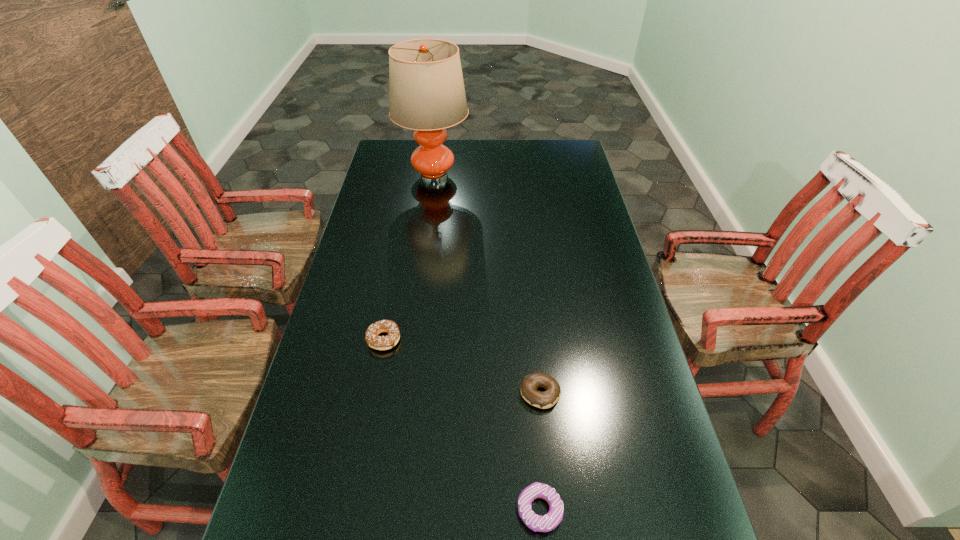
Identify which object is the third closest to the tallest object. Please provide its 2D coordinates. Your answer should be formatted as a tuple, i.e. [(x, y)], where the tuple contains the x and y coordinates of a point satisfying the conditions above.

[(546, 523)]

Where is `doughnut that is the second closest one to the second nearest doughnut`? The width and height of the screenshot is (960, 540). doughnut that is the second closest one to the second nearest doughnut is located at coordinates (373, 340).

Locate which doughnut ranks in proximity to the farthest object. Please provide its 2D coordinates. Your answer should be formatted as a tuple, i.e. [(x, y)], where the tuple contains the x and y coordinates of a point satisfying the conditions above.

[(373, 340)]

Where is `blank space that satisfies the following two spatial constraints: 1. on the front side of the third nearest object; 2. on the left side of the nearest doughnut`? blank space that satisfies the following two spatial constraints: 1. on the front side of the third nearest object; 2. on the left side of the nearest doughnut is located at coordinates (351, 509).

You are a GUI agent. You are given a task and a screenshot of the screen. Output one action in this format:
    pyautogui.click(x=<x>, y=<y>)
    Task: Click on the vacant position in the image that satisfies the following two spatial constraints: 1. on the back side of the second nearest doughnut; 2. on the right side of the nearest doughnut
    This screenshot has width=960, height=540.
    Given the screenshot: What is the action you would take?
    pyautogui.click(x=529, y=393)

Locate an element on the screen. This screenshot has width=960, height=540. free space that satisfies the following two spatial constraints: 1. on the back side of the nearest object; 2. on the left side of the second farthest doughnut is located at coordinates (529, 393).